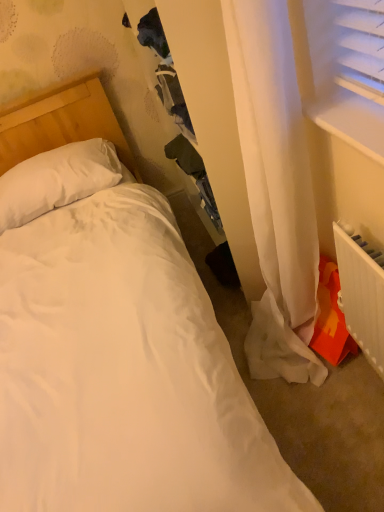
Question: Would you say white plastic window sill at upper right is to the left or to the right of white soft pillow at upper left in the picture?

Choices:
 (A) left
 (B) right

Answer: (B)

Question: In the image, is white plastic window sill at upper right positioned in front of or behind white soft pillow at upper left?

Choices:
 (A) front
 (B) behind

Answer: (A)

Question: Which object is positioned farthest from the white soft pillow at upper left?

Choices:
 (A) white plastic window sill at upper right
 (B) white plastic radiator at lower right

Answer: (B)

Question: Estimate the real-world distances between objects in this image. Which object is closer to the white plastic radiator at lower right?

Choices:
 (A) white plastic window sill at upper right
 (B) white soft pillow at upper left

Answer: (A)